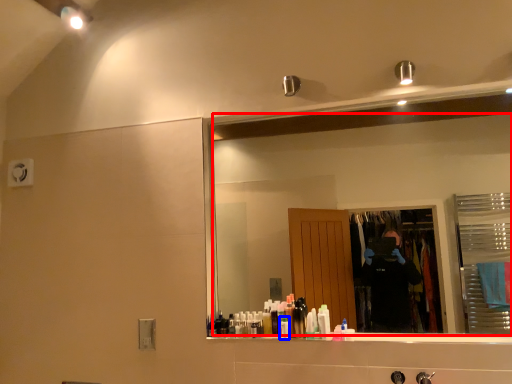
Question: Which object is closer to the camera taking this photo, mirror (highlighted by a red box) or toiletry (highlighted by a blue box)?

Choices:
 (A) mirror
 (B) toiletry

Answer: (A)